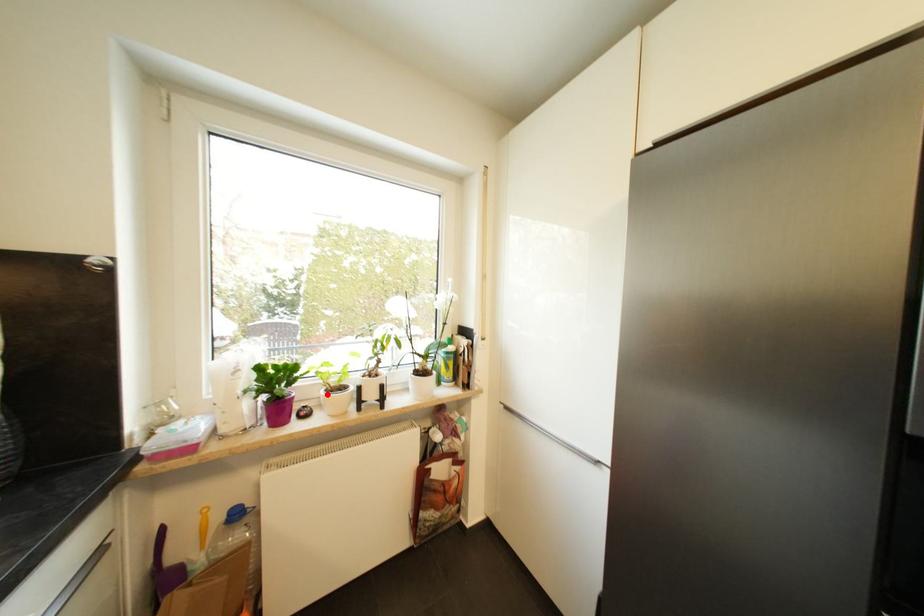
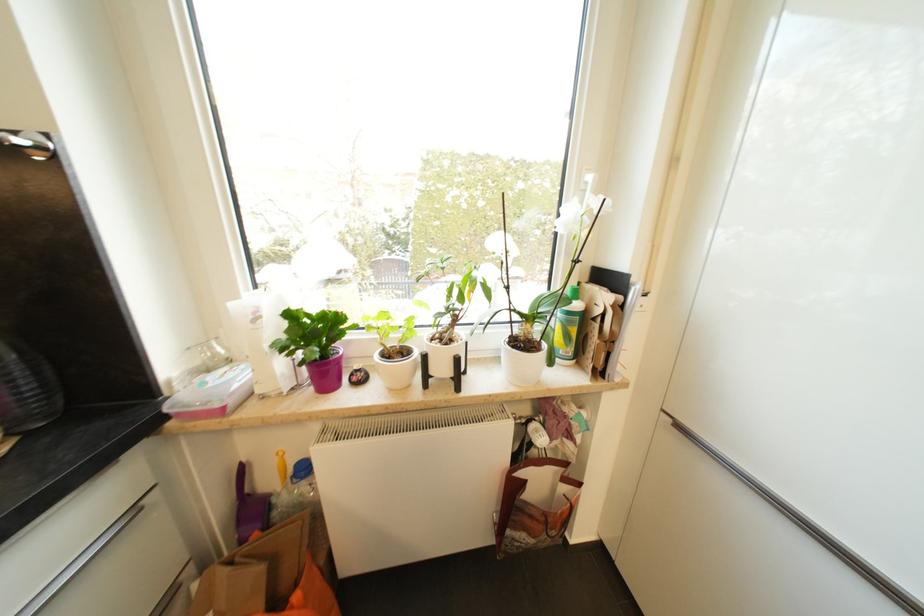
Locate, in the second image, the point that corresponds to the highlighted location in the first image.

(381, 358)